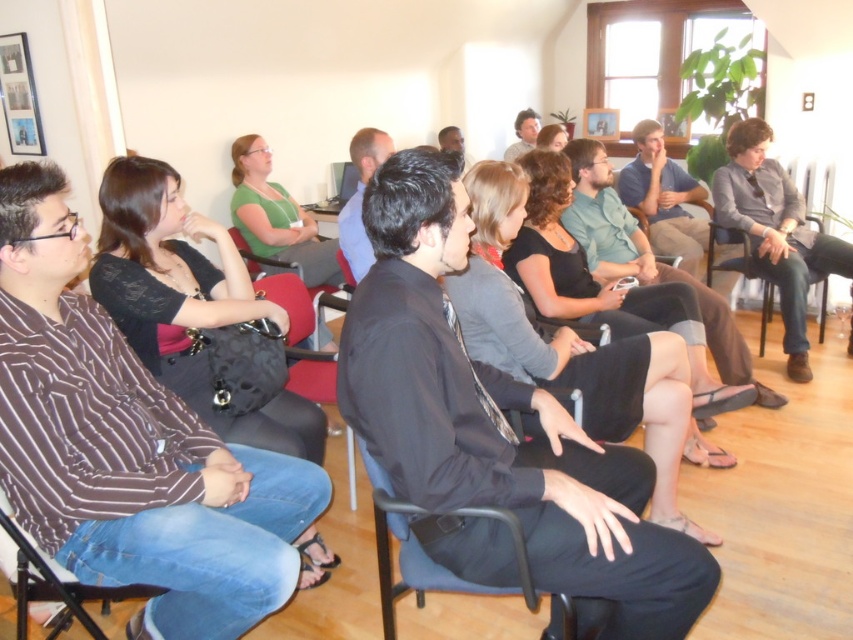
In the scene shown: Does gray cotton shirt at right appear over black fabric chair at center?

Correct, gray cotton shirt at right is located above black fabric chair at center.

Is point (770, 280) less distant than point (397, 516)?

That is False.

Locate an element on the screen. This screenshot has width=853, height=640. gray cotton shirt at right is located at coordinates (775, 230).

Is striped fabric chair at lower left below black fabric chair at right?

Correct, striped fabric chair at lower left is located below black fabric chair at right.

Between striped fabric chair at lower left and black fabric chair at right, which one is positioned higher?

black fabric chair at right is above.

Identify the location of striped fabric chair at lower left. (56, 582).

Locate an element on the screen. striped fabric chair at lower left is located at coordinates (56, 582).

Between point (434, 572) and point (100, 637), which one is positioned in front?

Positioned in front is point (434, 572).

At what (x,y) coordinates should I click in order to perform the action: click on black fabric chair at center. Please return your answer as a coordinate pair (x, y). Looking at the image, I should click on (422, 548).

Where is `black fabric chair at center`? The image size is (853, 640). black fabric chair at center is located at coordinates 422,548.